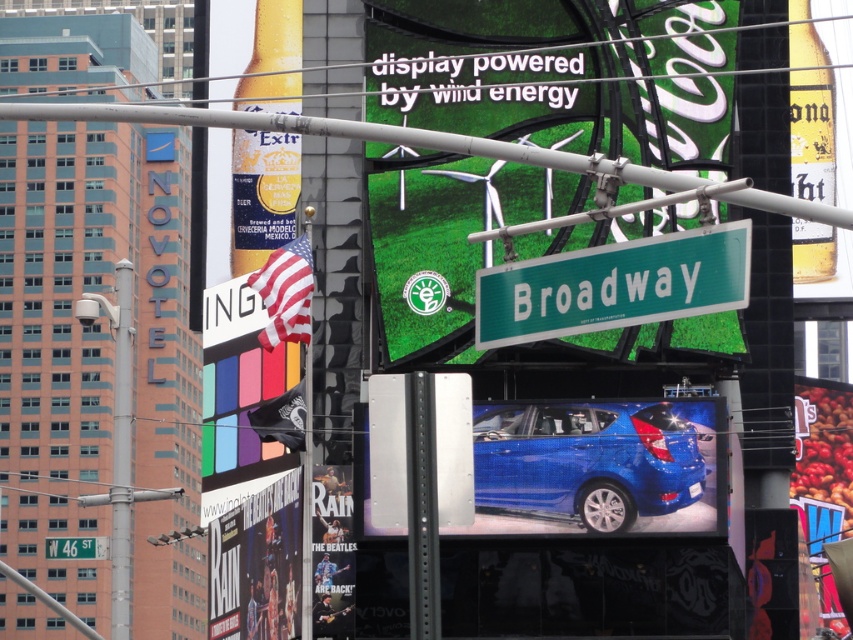
Is glossy blue hatchback at center above green plastic street sign at center?

Actually, glossy blue hatchback at center is below green plastic street sign at center.

Does point (653, 419) lie in front of point (517, 266)?

No, it is not.

The width and height of the screenshot is (853, 640). I want to click on glossy blue hatchback at center, so click(596, 465).

Can you confirm if matte black poster at lower left is thinner than matte black guitar at lower left?

A: Incorrect, matte black poster at lower left's width is not less than matte black guitar at lower left's.

Can you confirm if matte black poster at lower left is taller than matte black guitar at lower left?

Yes, matte black poster at lower left is taller than matte black guitar at lower left.

Does point (280, 477) lie in front of point (345, 628)?

No.

The image size is (853, 640). What are the coordinates of `matte black poster at lower left` in the screenshot? It's located at (257, 564).

Is green matte signboard at center taller than green plastic street sign at center?

Yes, green matte signboard at center is taller than green plastic street sign at center.

What do you see at coordinates (560, 74) in the screenshot? Image resolution: width=853 pixels, height=640 pixels. I see `green matte signboard at center` at bounding box center [560, 74].

You are a GUI agent. You are given a task and a screenshot of the screen. Output one action in this format:
    pyautogui.click(x=<x>, y=<y>)
    Task: Click on the green matte signboard at center
    
    Given the screenshot: What is the action you would take?
    pyautogui.click(x=560, y=74)

Locate an element on the screen. This screenshot has height=640, width=853. green matte signboard at center is located at coordinates pyautogui.click(x=560, y=74).